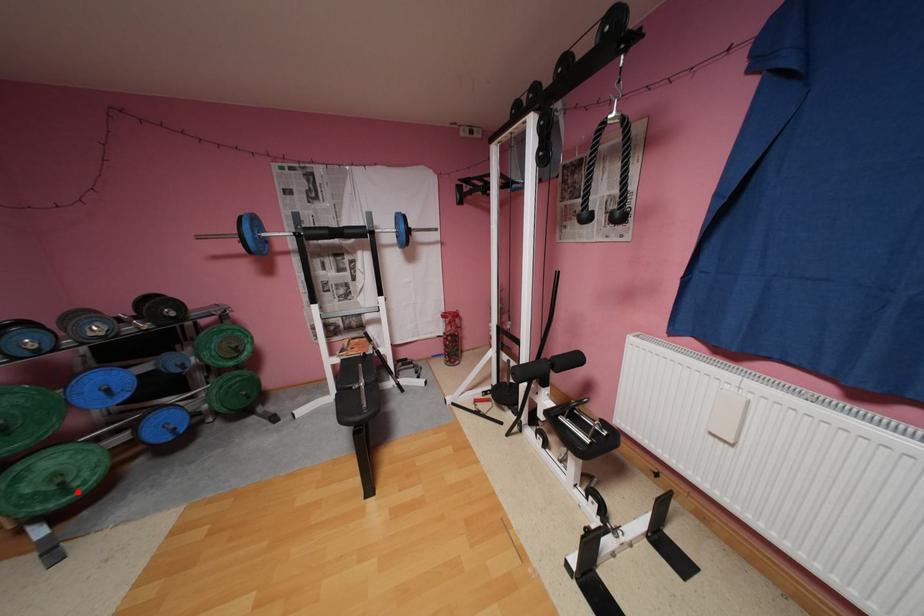
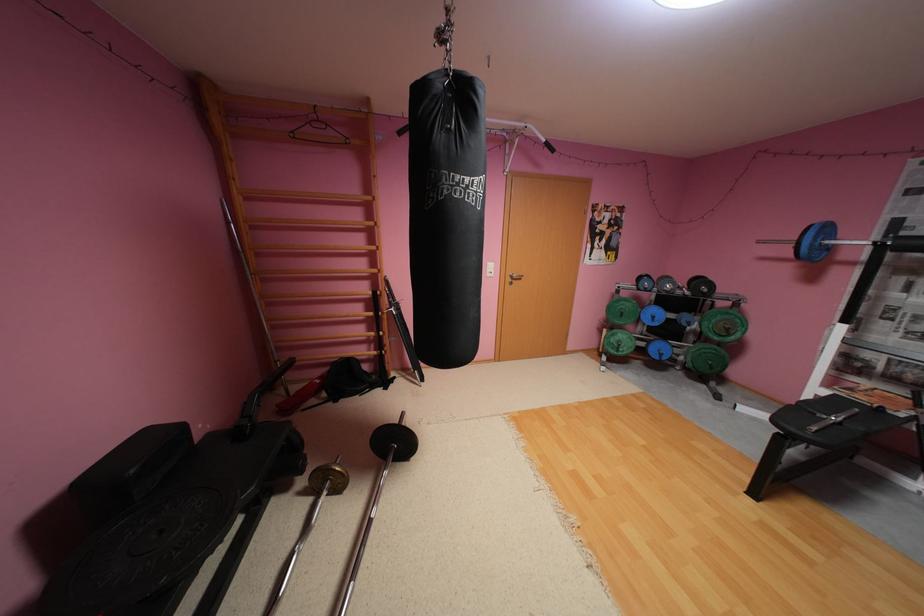
Locate, in the second image, the point that corresponds to the highlighted location in the first image.

(626, 351)